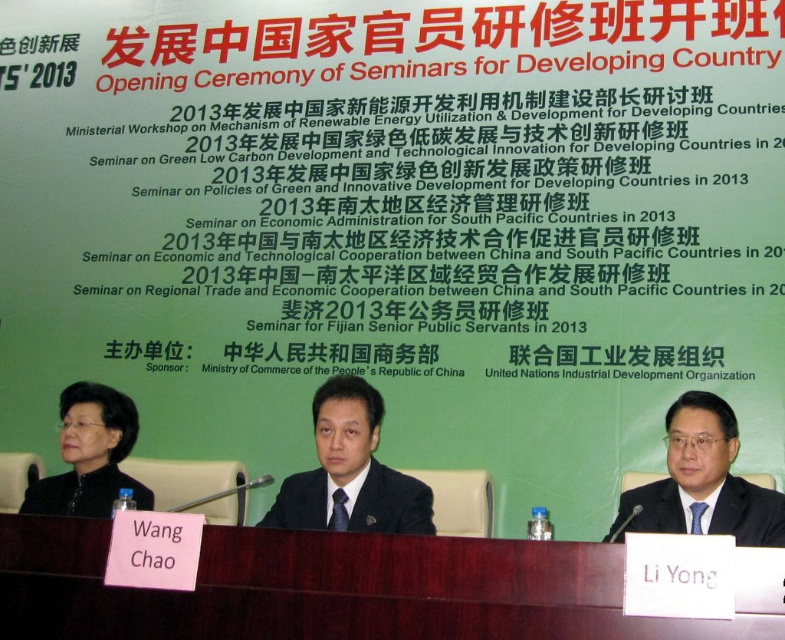
Does black matte suit at center come in front of black matte business suit at left?

Yes, it is in front of black matte business suit at left.

This screenshot has height=640, width=785. Describe the element at coordinates (391, 502) in the screenshot. I see `black matte suit at center` at that location.

Find the location of a particular element. The image size is (785, 640). black matte suit at center is located at coordinates (391, 502).

Who is shorter, dark blue suit at right or black matte suit at center?

With less height is black matte suit at center.

Measure the distance between dark blue suit at right and camera.

dark blue suit at right and camera are 16.78 meters apart.

At what (x,y) coordinates should I click in order to perform the action: click on dark blue suit at right. Please return your answer as a coordinate pair (x, y). Looking at the image, I should click on (700, 483).

Can you confirm if black matte jacket at lower left is taller than black matte suit at center?

In fact, black matte jacket at lower left may be shorter than black matte suit at center.

Is point (103, 413) positioned behind point (371, 458)?

Yes, point (103, 413) is behind point (371, 458).

What do you see at coordinates (90, 456) in the screenshot?
I see `black matte jacket at lower left` at bounding box center [90, 456].

Where is `black matte jacket at lower left`? black matte jacket at lower left is located at coordinates (90, 456).